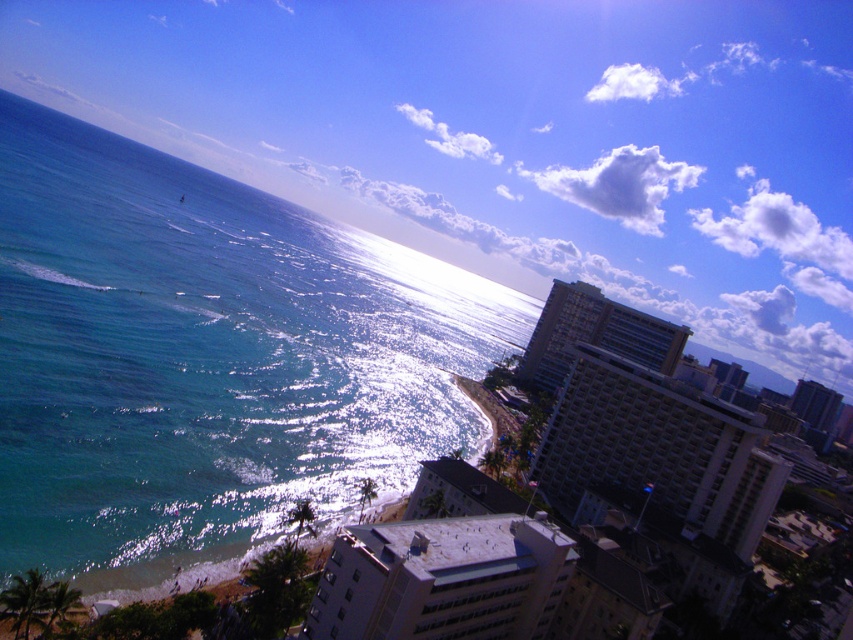
You are a photographer planning to capture a sunset shot from the beach. You notice the blue glossy water at left and the gray concrete building at center in your viewfinder. Based on their positions, which object should appear closer to the top of your photo?

The blue glossy water at left should appear closer to the top of your photo because it is located above the gray concrete building at center.

You are a drone operator tasked with capturing aerial footage of the coastal city. Your drone has a maximum flight range of 100 meters from its starting position. If you position the drone directly above the white glossy building at center, can it reach the gray concrete building at center without exceeding its range?

The distance between the white glossy building at center and the gray concrete building at center is 89.23 meters. Since the drone has a maximum range of 100 meters, it can safely reach the gray concrete building at center without exceeding its flight range.